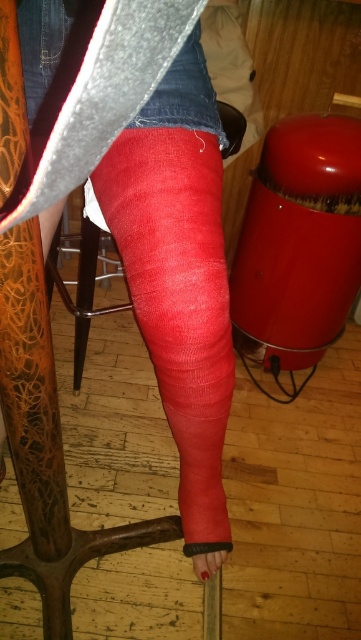
Is matte red cast at center to the left of matte red bandage at lower center from the viewer's perspective?

Yes, matte red cast at center is to the left of matte red bandage at lower center.

Does matte red cast at center have a lesser width compared to matte red bandage at lower center?

Incorrect, matte red cast at center's width is not less than matte red bandage at lower center's.

The height and width of the screenshot is (640, 361). What do you see at coordinates (179, 275) in the screenshot?
I see `matte red cast at center` at bounding box center [179, 275].

I want to click on matte red cast at center, so click(179, 275).

From the picture: Between red fabric sock at center and matte red bandage at lower center, which one has less height?

Standing shorter between the two is matte red bandage at lower center.

Does red fabric sock at center appear on the right side of matte red bandage at lower center?

No, red fabric sock at center is not to the right of matte red bandage at lower center.

The image size is (361, 640). What are the coordinates of `red fabric sock at center` in the screenshot? It's located at (179, 300).

You are a GUI agent. You are given a task and a screenshot of the screen. Output one action in this format:
    pyautogui.click(x=<x>, y=<y>)
    Task: Click on the red fabric sock at center
    The height and width of the screenshot is (640, 361).
    Given the screenshot: What is the action you would take?
    pyautogui.click(x=179, y=300)

Which is in front, point (211, 115) or point (209, 324)?

Point (209, 324) is in front.

Between matte red cast at center and red fabric sock at center, which one has less height?

red fabric sock at center is shorter.

I want to click on matte red cast at center, so click(x=179, y=275).